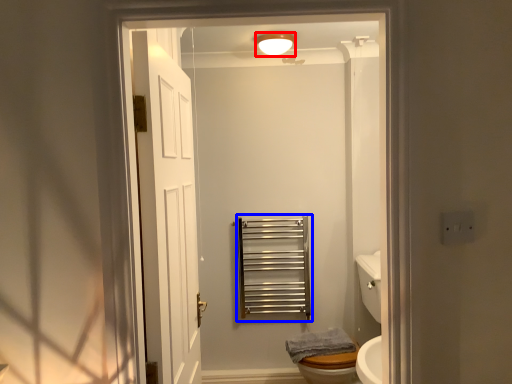
Question: Which of the following is the farthest to the observer, light fixture (highlighted by a red box) or balustrade (highlighted by a blue box)?

Choices:
 (A) light fixture
 (B) balustrade

Answer: (B)